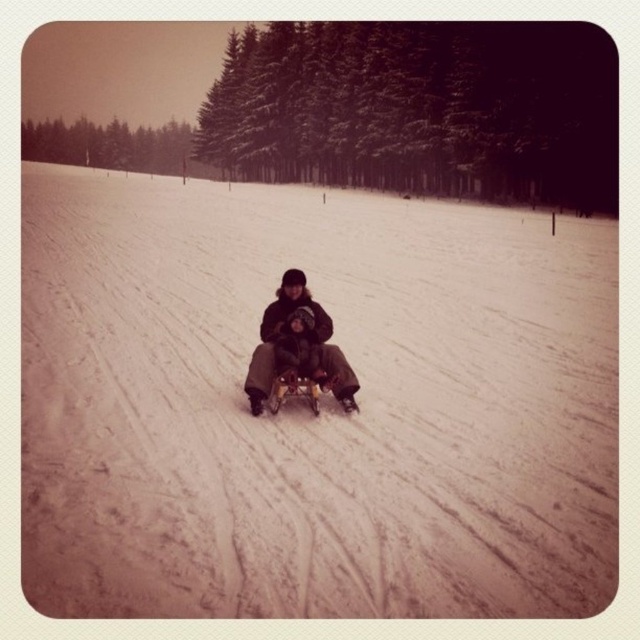
Is white powdery snow at center smaller than dark brown fabric snowboard at center?

No, white powdery snow at center is not smaller than dark brown fabric snowboard at center.

Between point (266, 556) and point (268, 324), which one is positioned in front?

Positioned in front is point (266, 556).

Measure the distance between point (x=548, y=429) and camera.

Point (x=548, y=429) and camera are 6.81 meters apart from each other.

This screenshot has height=640, width=640. Identify the location of white powdery snow at center. (307, 412).